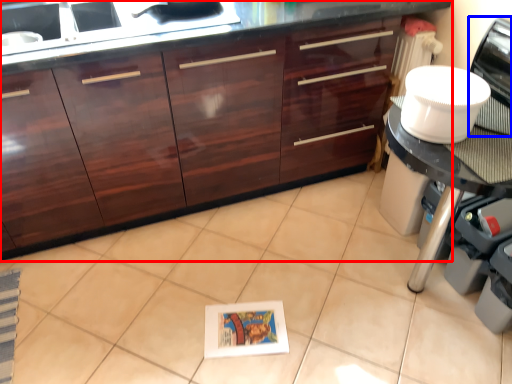
Question: Which point is closer to the camera, cabinetry (highlighted by a red box) or home appliance (highlighted by a blue box)?

Choices:
 (A) cabinetry
 (B) home appliance

Answer: (B)